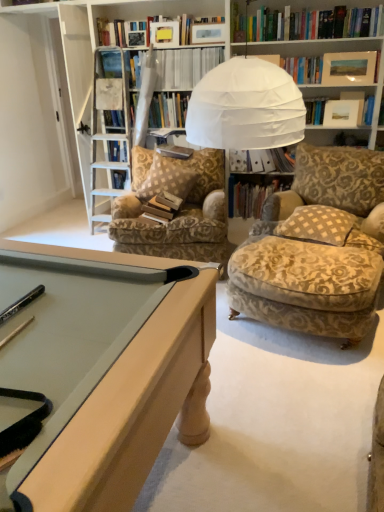
Question: Is brown checkered pillow at center, the first pillow in the back-to-front sequence, far away from hardcover book at center, positioned as the 3th book in top-to-bottom order?

Choices:
 (A) no
 (B) yes

Answer: (A)

Question: From a real-world perspective, is brown checkered pillow at center, the second pillow positioned from the right, located beneath hardcover book at center, positioned as the 3th book in top-to-bottom order?

Choices:
 (A) yes
 (B) no

Answer: (B)

Question: Does brown checkered pillow at center, which is the second pillow in front-to-back order, have a lesser width compared to hardcover book at center, placed as the second book when sorted from bottom to top?

Choices:
 (A) yes
 (B) no

Answer: (B)

Question: Could you tell me if brown checkered pillow at center, which ranks as the first pillow in left-to-right order, is turned towards hardcover book at center, positioned as the 3th book in top-to-bottom order?

Choices:
 (A) no
 (B) yes

Answer: (A)

Question: Is brown checkered pillow at center, which is the second pillow in front-to-back order, wider than hardcover book at center, placed as the second book when sorted from bottom to top?

Choices:
 (A) yes
 (B) no

Answer: (A)

Question: Is brown checkered pillow at center, which is the second pillow in front-to-back order, positioned beyond the bounds of hardcover book at center, positioned as the 3th book in top-to-bottom order?

Choices:
 (A) yes
 (B) no

Answer: (A)

Question: Considering the relative positions of matte wooden picture frame at upper right and brown checkered pillow at center, the first pillow in the back-to-front sequence, in the image provided, is matte wooden picture frame at upper right to the right of brown checkered pillow at center, the first pillow in the back-to-front sequence, from the viewer's perspective?

Choices:
 (A) no
 (B) yes

Answer: (B)

Question: Is matte wooden picture frame at upper right next to brown checkered pillow at center, which ranks as the first pillow in left-to-right order?

Choices:
 (A) no
 (B) yes

Answer: (A)

Question: Is matte wooden picture frame at upper right thinner than brown checkered pillow at center, which ranks as the first pillow in left-to-right order?

Choices:
 (A) no
 (B) yes

Answer: (B)

Question: Does matte wooden picture frame at upper right have a lesser height compared to brown checkered pillow at center, which ranks as the first pillow in left-to-right order?

Choices:
 (A) yes
 (B) no

Answer: (A)

Question: Can you confirm if matte wooden picture frame at upper right is wider than brown checkered pillow at center, which ranks as the first pillow in left-to-right order?

Choices:
 (A) no
 (B) yes

Answer: (A)

Question: Is there a large distance between matte wooden picture frame at upper right and brown checkered pillow at center, which is the second pillow in front-to-back order?

Choices:
 (A) yes
 (B) no

Answer: (A)

Question: From the image's perspective, would you say white paper file at center, arranged as the third book when ordered from the bottom, is shown under brown checkered pillow at center, the first pillow in the back-to-front sequence?

Choices:
 (A) yes
 (B) no

Answer: (B)